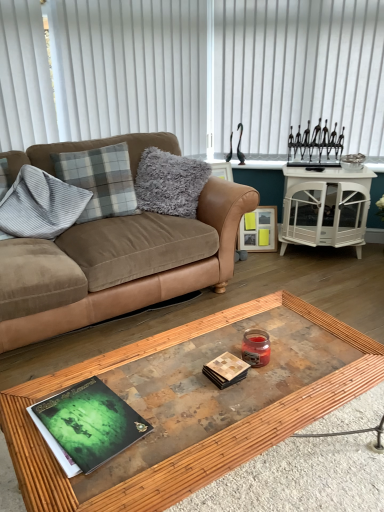
Question: Based on their positions, is green matte book at center, the first magazine viewed from the left, located to the left or right of suede couch at left?

Choices:
 (A) right
 (B) left

Answer: (A)

Question: Is point (122, 437) positioned closer to the camera than point (49, 150)?

Choices:
 (A) farther
 (B) closer

Answer: (B)

Question: Estimate the real-world distances between objects in this image. Which object is farther from the white vertical blinds at upper center, which is the second blind in left-to-right order?

Choices:
 (A) gray corduroy pillow at left, which ranks as the 3th pillow in right-to-left order
 (B) white glossy cabinet at upper right
 (C) suede couch at left
 (D) plaid fabric pillow at upper left, the 2th pillow in the right-to-left sequence
 (E) wooden glass coffee table at center

Answer: (E)

Question: Estimate the real-world distances between objects in this image. Which object is closer to the white vertical blinds at upper center, the first blind viewed from the right?

Choices:
 (A) white glossy cabinet at upper right
 (B) plaid fabric pillow at upper left, the 2th pillow in the right-to-left sequence
 (C) wooden picture frame at upper right
 (D) wooden glass coffee table at center
 (E) green matte book at center, the first magazine viewed from the left

Answer: (A)